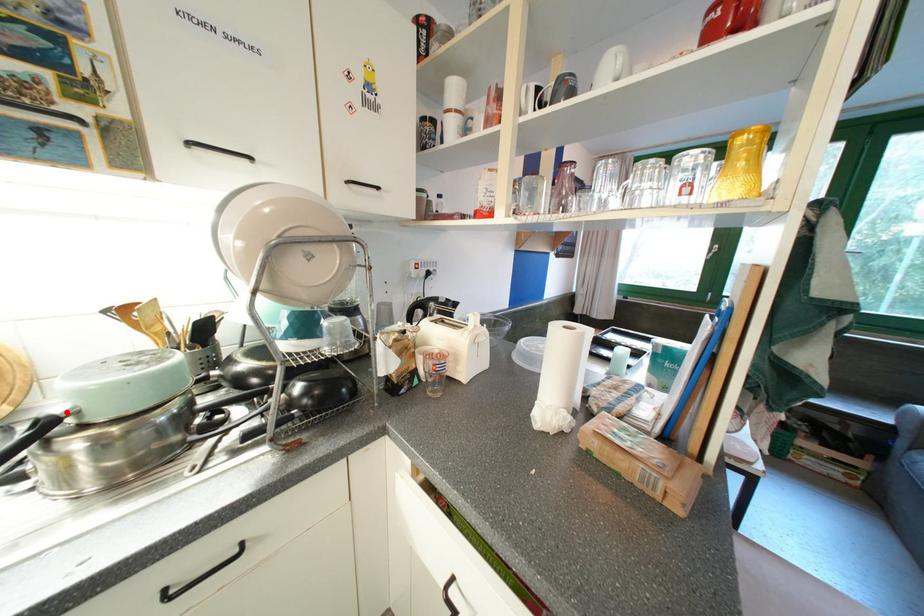
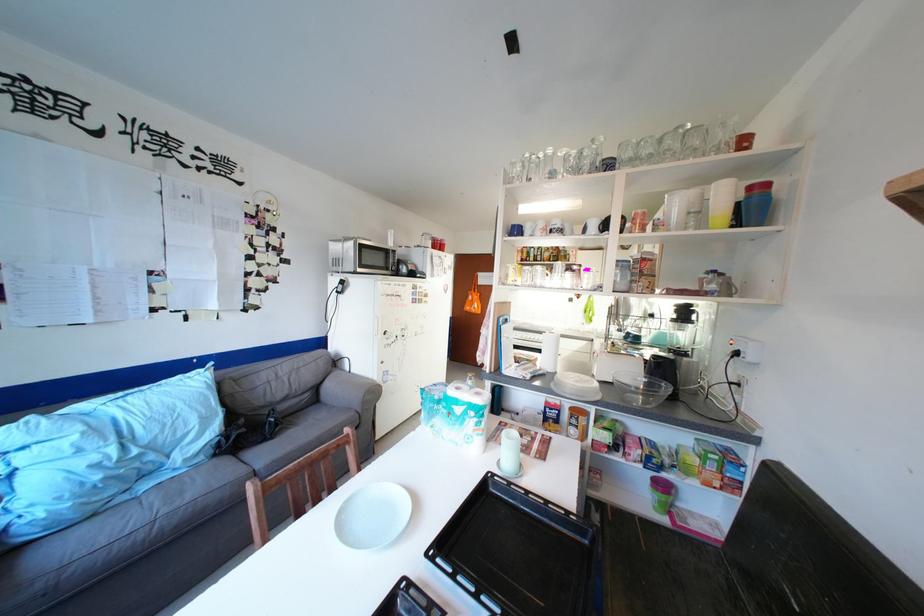
Question: I am providing you with two images of the same scene from different viewpoints. A red point is marked on the first image. Is the red point's position out of view in image 2?

Choices:
 (A) Yes
 (B) No

Answer: (A)